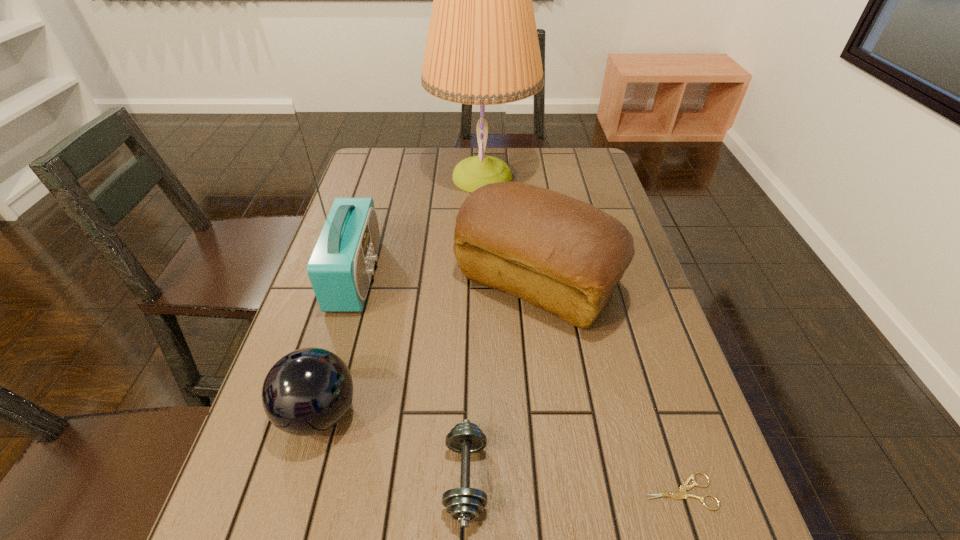
Identify the location of the farthest object. (482, 48).

Locate an element on the screen. The height and width of the screenshot is (540, 960). the tallest object is located at coordinates (482, 48).

Locate an element on the screen. radio receiver is located at coordinates (340, 268).

The image size is (960, 540). Identify the location of bread. (565, 256).

I want to click on bowling ball, so click(x=306, y=392).

The width and height of the screenshot is (960, 540). I want to click on the fifth tallest object, so click(x=464, y=504).

This screenshot has height=540, width=960. Find the location of `shears`. shears is located at coordinates (682, 494).

Where is `vacant position located on the side of the lamp near the pull switch`? The width and height of the screenshot is (960, 540). vacant position located on the side of the lamp near the pull switch is located at coordinates (412, 177).

Identify the location of free spot located 0.100m on the side of the lamp near the pull switch. (399, 177).

Find the location of a particular element. blank area located 0.080m on the side of the lamp near the pull switch is located at coordinates (406, 177).